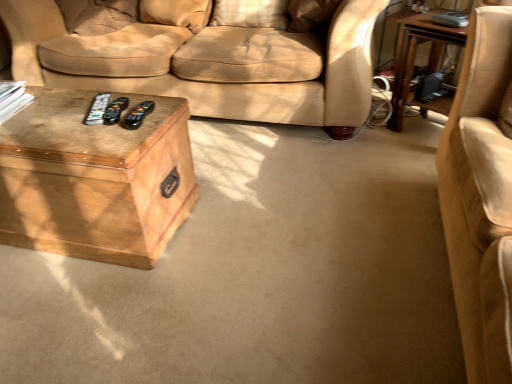
Locate an element on the screen. The image size is (512, 384). free space to the left of wooden table at right, arranged as the first table when viewed from the right is located at coordinates (378, 135).